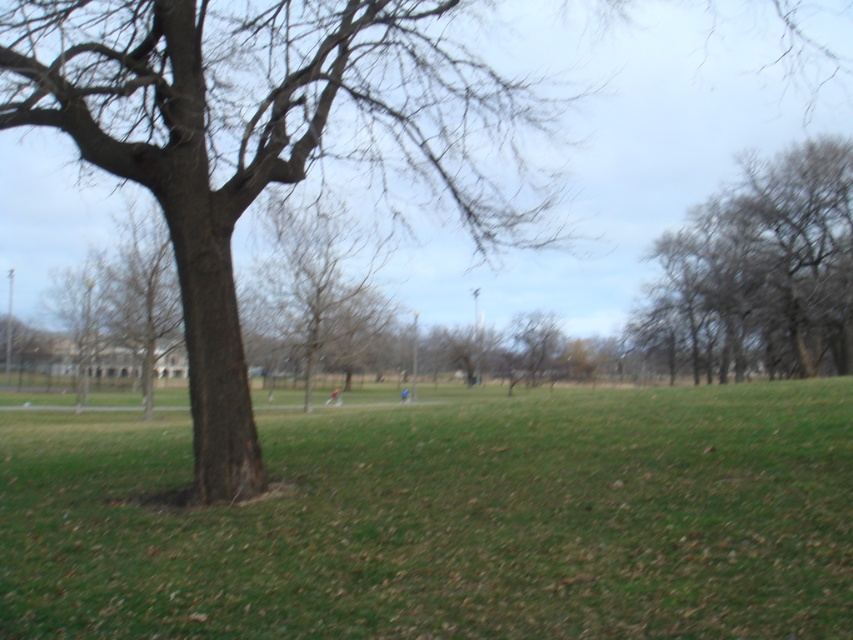
Does brown rough bark tree at left lie in front of gray textured tree at upper right?

That is True.

What do you see at coordinates (268, 141) in the screenshot? The width and height of the screenshot is (853, 640). I see `brown rough bark tree at left` at bounding box center [268, 141].

Is point (222, 403) positioned behind point (839, 225)?

No, (222, 403) is closer to viewer.

Identify the location of brown rough bark tree at left. (268, 141).

Is point (328, 61) closer to camera compared to point (271, 234)?

That is True.

Which is above, brown rough bark tree at left or bare wood tree at center?

brown rough bark tree at left is above.

Who is more forward, (x=515, y=189) or (x=305, y=259)?

Point (x=515, y=189)

The width and height of the screenshot is (853, 640). Find the location of `brown rough bark tree at left`. brown rough bark tree at left is located at coordinates (268, 141).

Between green grassy field at center and gray textured tree at upper right, which one has less height?

green grassy field at center is shorter.

Where is `green grassy field at center`? green grassy field at center is located at coordinates coord(450,520).

Between point (219, 529) and point (703, 344), which one is positioned behind?

The point (703, 344) is behind.

At what (x,y) coordinates should I click in order to perform the action: click on green grassy field at center. Please return your answer as a coordinate pair (x, y). Image resolution: width=853 pixels, height=640 pixels. Looking at the image, I should click on (450, 520).